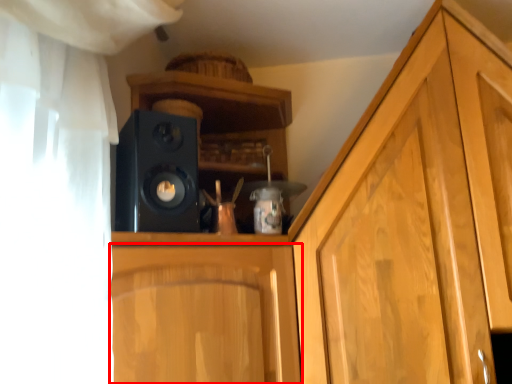
Question: Observing the image, what is the correct spatial positioning of cabinetry (annotated by the red box) in reference to speaker?

Choices:
 (A) right
 (B) left

Answer: (A)